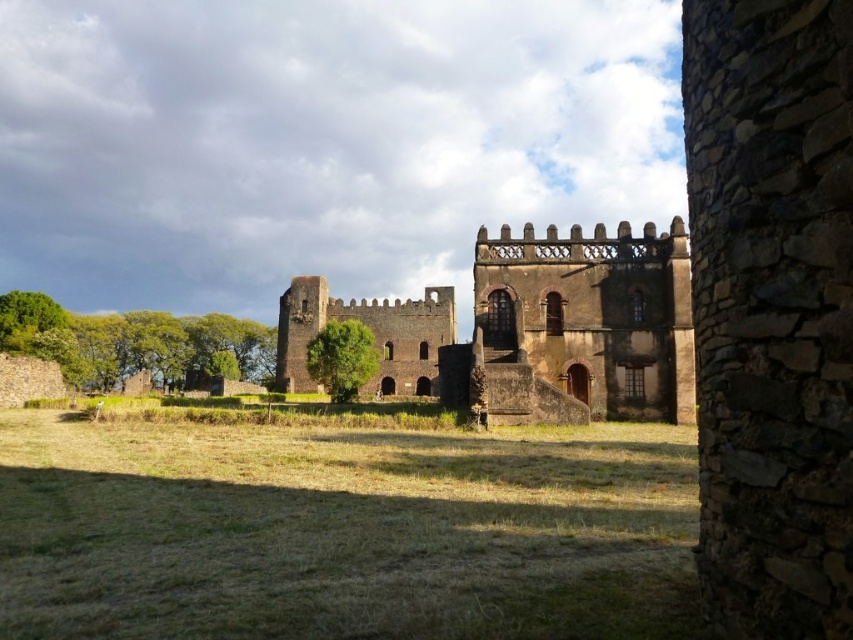
Question: Does green grass at center lie behind brown stone castle at center?

Choices:
 (A) yes
 (B) no

Answer: (B)

Question: Is green grass at center positioned behind brown stone castle at center?

Choices:
 (A) yes
 (B) no

Answer: (B)

Question: Which point is farther to the camera?

Choices:
 (A) (653, 225)
 (B) (51, 604)

Answer: (A)

Question: Among these points, which one is farthest from the camera?

Choices:
 (A) (321, 292)
 (B) (152, 438)

Answer: (A)

Question: Is green grass at center thinner than brown stone castle at center?

Choices:
 (A) yes
 (B) no

Answer: (B)